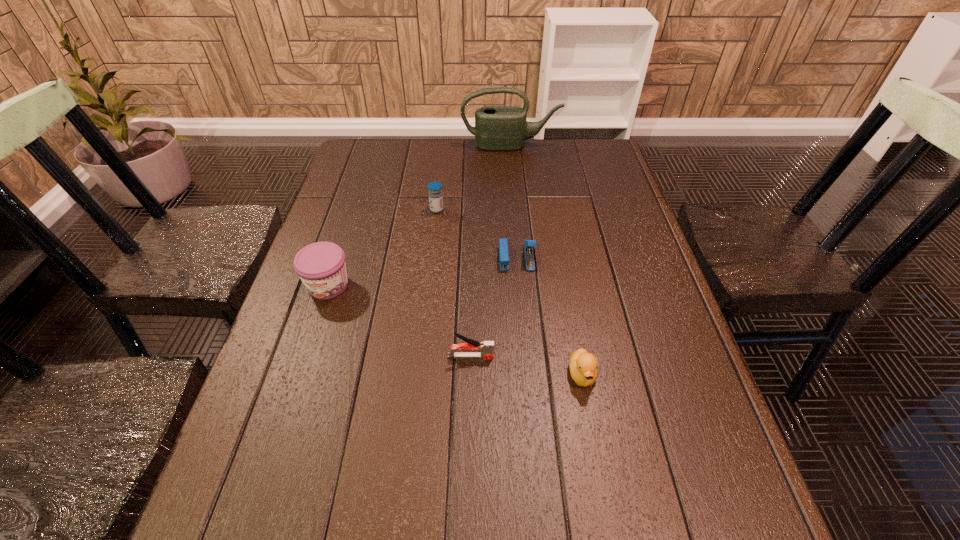
Image resolution: width=960 pixels, height=540 pixels. What are the coordinates of `vacant area situated on the left of the medicine` in the screenshot? It's located at (364, 210).

I want to click on vacant space positioned 0.090m on the handle side of the left stapler, so click(537, 356).

Find the location of a particular element. The height and width of the screenshot is (540, 960). vacant area located 0.200m on the left of the right stapler is located at coordinates (421, 258).

In order to click on vacant space located 0.120m facing forward on the duckling in this screenshot , I will do `click(597, 454)`.

Where is `object located in the far edge section of the desktop`? The image size is (960, 540). object located in the far edge section of the desktop is located at coordinates (500, 128).

Image resolution: width=960 pixels, height=540 pixels. In order to click on object located in the left edge section of the desktop in this screenshot , I will do `click(321, 266)`.

This screenshot has width=960, height=540. In the image, there is a desktop. In order to click on vacant space at the far edge in this screenshot , I will do `click(540, 152)`.

This screenshot has height=540, width=960. I want to click on free space at the left edge of the desktop, so click(367, 217).

You are a GUI agent. You are given a task and a screenshot of the screen. Output one action in this format:
    pyautogui.click(x=<x>, y=<y>)
    Task: Click on the blank space at the right edge of the desktop
    
    Given the screenshot: What is the action you would take?
    pyautogui.click(x=679, y=410)

The image size is (960, 540). Find the location of `free location at the far left corner`. free location at the far left corner is located at coordinates (392, 156).